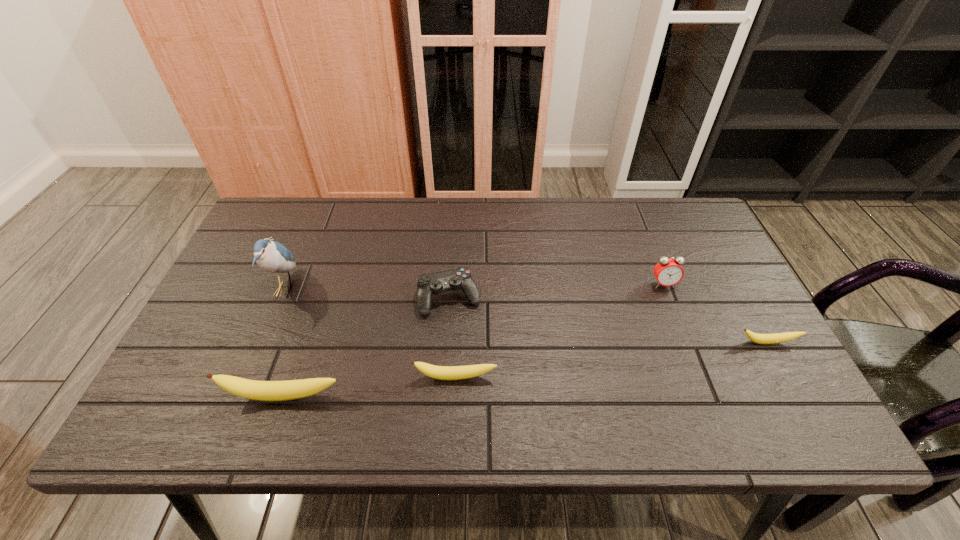
Where is `free space at the far left corner`? Image resolution: width=960 pixels, height=540 pixels. free space at the far left corner is located at coordinates (277, 233).

Locate an element on the screen. free location at the far right corner of the desktop is located at coordinates (663, 200).

Locate an element on the screen. The image size is (960, 540). vacant region between the control and the fifth object from left to right is located at coordinates (557, 291).

Find the location of a particular element. The height and width of the screenshot is (540, 960). unoccupied area between the tallest banana and the third nearest object is located at coordinates click(x=525, y=369).

You are a GUI agent. You are given a task and a screenshot of the screen. Output one action in this format:
    pyautogui.click(x=<x>, y=<y>)
    Task: Click on the vacant space that's between the bird and the second shortest banana
    
    Given the screenshot: What is the action you would take?
    pyautogui.click(x=370, y=333)

You are a GUI agent. You are given a task and a screenshot of the screen. Output one action in this format:
    pyautogui.click(x=<x>, y=<y>)
    Task: Click on the free space between the tallest object and the control
    The height and width of the screenshot is (540, 960).
    Given the screenshot: What is the action you would take?
    pyautogui.click(x=367, y=294)

Find the location of `vacant space that's between the bird and the control`. vacant space that's between the bird and the control is located at coordinates (367, 294).

Where is `unoccupied area between the fifth object from left to right and the control`? unoccupied area between the fifth object from left to right and the control is located at coordinates (557, 291).

At what (x,y) coordinates should I click in order to perform the action: click on free point between the second shortest banana and the control. Please return your answer as a coordinate pair (x, y). The image size is (960, 540). Looking at the image, I should click on (452, 338).

Image resolution: width=960 pixels, height=540 pixels. Identify the location of vacant space that is in between the tallest object and the farthest banana. (526, 316).